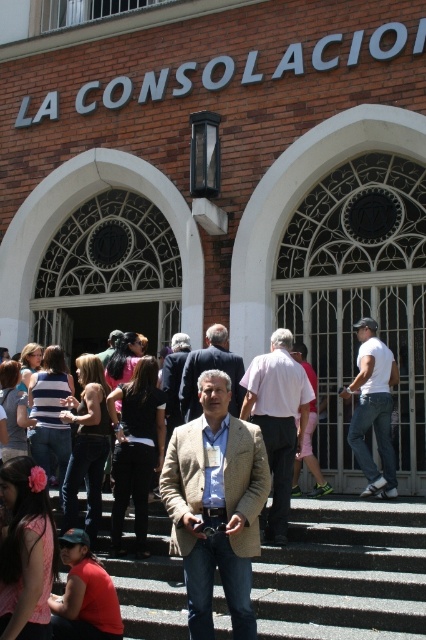
Does tan fabric jacket at center have a lesser height compared to white matte shirt at right?

In fact, tan fabric jacket at center may be taller than white matte shirt at right.

Does tan fabric jacket at center have a lesser width compared to white matte shirt at right?

Yes.

Locate an element on the screen. This screenshot has width=426, height=640. tan fabric jacket at center is located at coordinates (278, 419).

In order to click on tan fabric jacket at center in this screenshot , I will do `click(278, 419)`.

Who is taller, concrete stairs at center or dark blue suit at center?

With more height is concrete stairs at center.

Which is above, concrete stairs at center or dark blue suit at center?

dark blue suit at center is higher up.

This screenshot has height=640, width=426. Describe the element at coordinates (345, 572) in the screenshot. I see `concrete stairs at center` at that location.

Identify the location of concrete stairs at center. pos(345,572).

Does concrete stairs at center have a larger size compared to tan fabric jacket at center?

Indeed, concrete stairs at center has a larger size compared to tan fabric jacket at center.

Who is more distant from viewer, (135,637) or (284,497)?

Point (284,497)

Find the location of a particular element. Image resolution: width=426 pixels, height=640 pixels. concrete stairs at center is located at coordinates (345, 572).